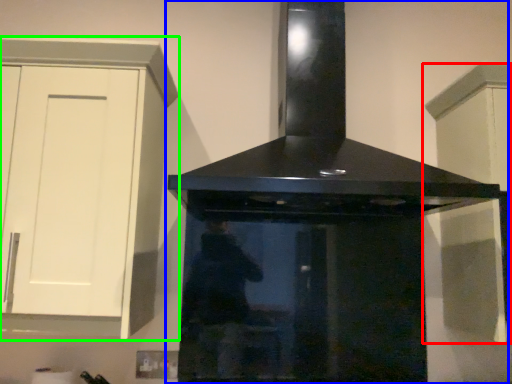
Question: Based on their relative distances, which object is farther from cabinetry (highlighted by a red box)? Choose from home appliance (highlighted by a blue box) and cabinetry (highlighted by a green box).

Choices:
 (A) home appliance
 (B) cabinetry

Answer: (B)